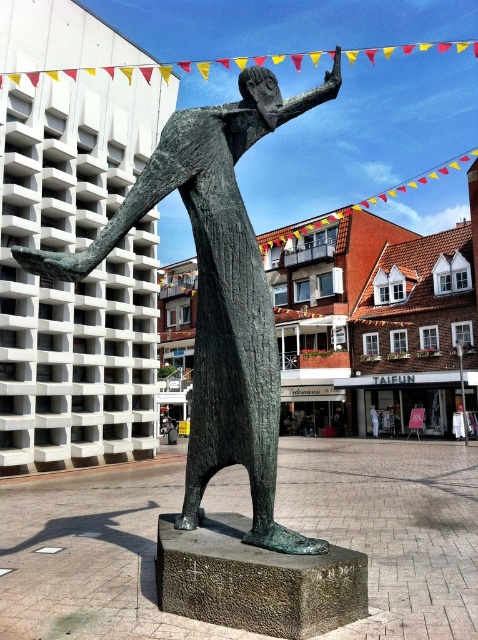
You are standing in the town square and see the bronze statue at center and the blue fabric person at center. Which object is positioned higher from the ground?

The bronze statue at center is located above the blue fabric person at center, so it is positioned higher from the ground.

You are an architect designing a new plaza and want to place a bench so that it is exactly at the center of the plaza. The plaza is shaped like a square with coordinates from 0 to 1 on both axes. The bronze statue at center is located at point (217, 291). Can you place the bench at the plaza center without overlapping the statue?

The plaza center is at point 0.5, 0.5. The bronze statue at center is located at (217, 291), which is slightly to the lower left of the plaza center. Therefore, you can place the bench at the exact center 0.5, 0.5 without overlapping the statue.

You are standing at the edge of the town square and see the bronze statue at center and the blue fabric person at center. If you want to take a photo that includes both of them in the frame, will you need to zoom out or zoom in your camera?

The bronze statue at center and the blue fabric person at center are 22.67 meters apart. To include both in the frame, you need to zoom out.